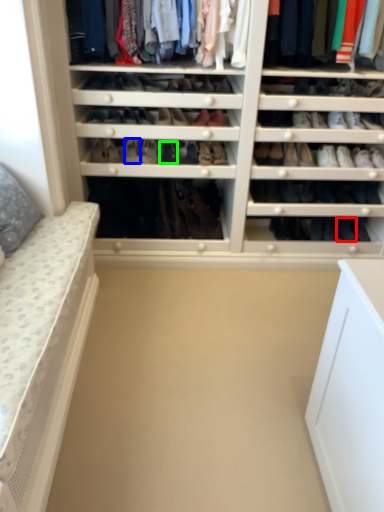
Question: Which object is positioned closest to shoe (highlighted by a red box)? Select from shoe (highlighted by a blue box) and shoe (highlighted by a green box).

Choices:
 (A) shoe
 (B) shoe

Answer: (B)